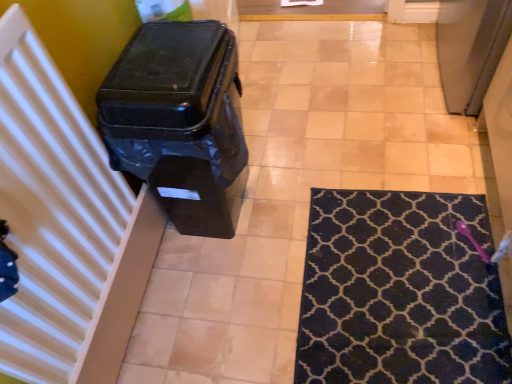
Question: Can you confirm if black plastic waste container at left is bigger than white striped radiator at left?

Choices:
 (A) yes
 (B) no

Answer: (A)

Question: From a real-world perspective, is black plastic waste container at left beneath white striped radiator at left?

Choices:
 (A) no
 (B) yes

Answer: (B)

Question: Is black plastic waste container at left taller than white striped radiator at left?

Choices:
 (A) no
 (B) yes

Answer: (B)

Question: Is white striped radiator at left a part of black plastic waste container at left?

Choices:
 (A) yes
 (B) no

Answer: (B)

Question: Can you confirm if black plastic waste container at left is wider than white striped radiator at left?

Choices:
 (A) no
 (B) yes

Answer: (B)

Question: Relative to black plastic waste container at left, is white striped radiator at left in front or behind?

Choices:
 (A) front
 (B) behind

Answer: (A)

Question: From the image's perspective, is white striped radiator at left above or below black plastic waste container at left?

Choices:
 (A) below
 (B) above

Answer: (A)

Question: Would you say white striped radiator at left is to the left or to the right of black plastic waste container at left in the picture?

Choices:
 (A) right
 (B) left

Answer: (B)

Question: Is white striped radiator at left wider or thinner than black plastic waste container at left?

Choices:
 (A) thin
 (B) wide

Answer: (A)

Question: Is navy blue textured rug at lower right spatially inside black plastic waste container at left, or outside of it?

Choices:
 (A) inside
 (B) outside

Answer: (B)

Question: In terms of size, does navy blue textured rug at lower right appear bigger or smaller than black plastic waste container at left?

Choices:
 (A) small
 (B) big

Answer: (A)

Question: Visually, is navy blue textured rug at lower right positioned to the left or to the right of black plastic waste container at left?

Choices:
 (A) right
 (B) left

Answer: (A)

Question: In terms of width, does navy blue textured rug at lower right look wider or thinner when compared to black plastic waste container at left?

Choices:
 (A) thin
 (B) wide

Answer: (B)

Question: Based on their sizes in the image, would you say navy blue textured rug at lower right is bigger or smaller than white striped radiator at left?

Choices:
 (A) small
 (B) big

Answer: (A)

Question: Considering the positions of point (322, 294) and point (59, 29), is point (322, 294) closer or farther from the camera than point (59, 29)?

Choices:
 (A) closer
 (B) farther

Answer: (B)